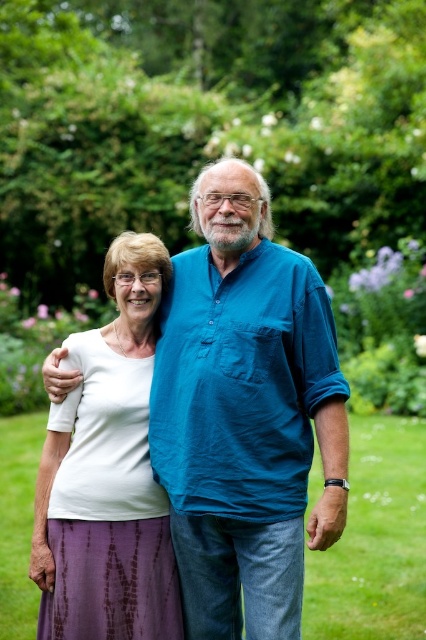
Who is more distant from viewer, [339,472] or [141,449]?

The point [141,449] is more distant.

Is white cotton shirt at center positioned behind white matte shirt at center?

No, it is not.

Identify the location of white cotton shirt at center. (245, 413).

Where is `white cotton shirt at center`? The height and width of the screenshot is (640, 426). white cotton shirt at center is located at coordinates (245, 413).